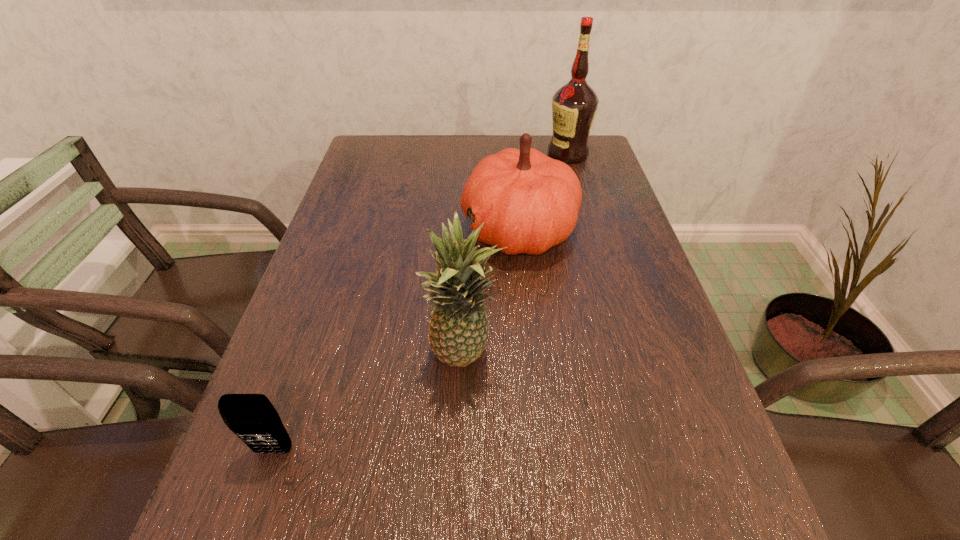
The height and width of the screenshot is (540, 960). In order to click on vacant region located on the label of the alcohol in this screenshot , I will do `click(528, 154)`.

Identify the location of free space located 0.200m on the left of the second nearest object. The image size is (960, 540). (322, 357).

Where is `vacant area situated 0.280m on the front-facing side of the pumpkin`? This screenshot has width=960, height=540. vacant area situated 0.280m on the front-facing side of the pumpkin is located at coordinates (349, 230).

At what (x,y) coordinates should I click in order to perform the action: click on blank space located on the front-facing side of the pumpkin. Please return your answer as a coordinate pair (x, y). Looking at the image, I should click on (370, 230).

Find the location of a particular element. free space located 0.170m on the front-facing side of the pumpkin is located at coordinates (394, 230).

You are a GUI agent. You are given a task and a screenshot of the screen. Output one action in this format:
    pyautogui.click(x=<x>, y=<y>)
    Task: Click on the vacant space located 0.070m on the screen of the nearest object
    This screenshot has height=540, width=960.
    Given the screenshot: What is the action you would take?
    pyautogui.click(x=254, y=508)

Identify the location of object that is at the far edge. (574, 105).

Where is `object that is positioned at the left edge`? This screenshot has height=540, width=960. object that is positioned at the left edge is located at coordinates (252, 417).

I want to click on alcohol located in the right edge section of the desktop, so click(574, 105).

Locate an element on the screen. Image resolution: width=960 pixels, height=540 pixels. pumpkin situated at the right edge is located at coordinates (529, 202).